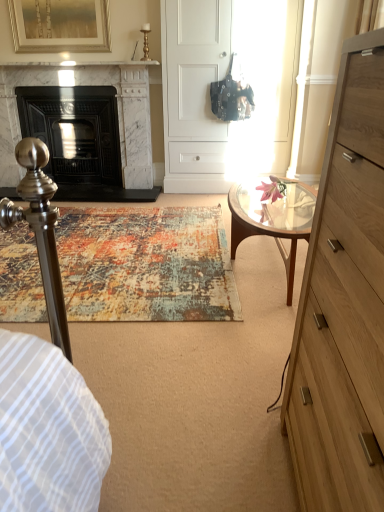
Question: Considering the relative sizes of matte black fireplace at left, which is counted as the first fireplace, starting from the left, and light brown wood chest of drawers at right in the image provided, is matte black fireplace at left, which is counted as the first fireplace, starting from the left, thinner than light brown wood chest of drawers at right?

Choices:
 (A) no
 (B) yes

Answer: (A)

Question: Is matte black fireplace at left, which is counted as the first fireplace, starting from the left, next to light brown wood chest of drawers at right and touching it?

Choices:
 (A) yes
 (B) no

Answer: (B)

Question: Is matte black fireplace at left, which is the second fireplace from right to left, not near light brown wood chest of drawers at right?

Choices:
 (A) no
 (B) yes

Answer: (B)

Question: Is matte black fireplace at left, which is the second fireplace from right to left, looking in the opposite direction of light brown wood chest of drawers at right?

Choices:
 (A) yes
 (B) no

Answer: (B)

Question: Is matte black fireplace at left, which is the second fireplace from right to left, smaller than light brown wood chest of drawers at right?

Choices:
 (A) yes
 (B) no

Answer: (B)

Question: Does point (54, 70) appear closer or farther from the camera than point (66, 132)?

Choices:
 (A) closer
 (B) farther

Answer: (A)

Question: Is white marble fireplace at left, which is the 2th fireplace from left to right, inside or outside of matte black fireplace at left, which is the second fireplace from right to left?

Choices:
 (A) inside
 (B) outside

Answer: (A)

Question: Considering the positions of white marble fireplace at left, which is the 2th fireplace from left to right, and matte black fireplace at left, which is the second fireplace from right to left, in the image, is white marble fireplace at left, which is the 2th fireplace from left to right, bigger or smaller than matte black fireplace at left, which is the second fireplace from right to left,?

Choices:
 (A) big
 (B) small

Answer: (A)

Question: Considering the relative positions of white marble fireplace at left, which is counted as the first fireplace, starting from the right, and matte black fireplace at left, which is the second fireplace from right to left, in the image provided, is white marble fireplace at left, which is counted as the first fireplace, starting from the right, to the left or to the right of matte black fireplace at left, which is the second fireplace from right to left,?

Choices:
 (A) left
 (B) right

Answer: (B)

Question: Is point (16, 37) closer or farther from the camera than point (253, 212)?

Choices:
 (A) farther
 (B) closer

Answer: (A)

Question: Is gold-framed artwork at upper left situated inside clear glass coffee table at center or outside?

Choices:
 (A) outside
 (B) inside

Answer: (A)

Question: From a real-world perspective, is gold-framed artwork at upper left above or below clear glass coffee table at center?

Choices:
 (A) below
 (B) above

Answer: (B)

Question: Considering the positions of gold-framed artwork at upper left and clear glass coffee table at center in the image, is gold-framed artwork at upper left bigger or smaller than clear glass coffee table at center?

Choices:
 (A) small
 (B) big

Answer: (A)

Question: In terms of width, does matte black fireplace at left, which is counted as the first fireplace, starting from the left, look wider or thinner when compared to light brown wood chest of drawers at right?

Choices:
 (A) wide
 (B) thin

Answer: (A)

Question: Choose the correct answer: Is matte black fireplace at left, which is the second fireplace from right to left, inside light brown wood chest of drawers at right or outside it?

Choices:
 (A) outside
 (B) inside

Answer: (A)